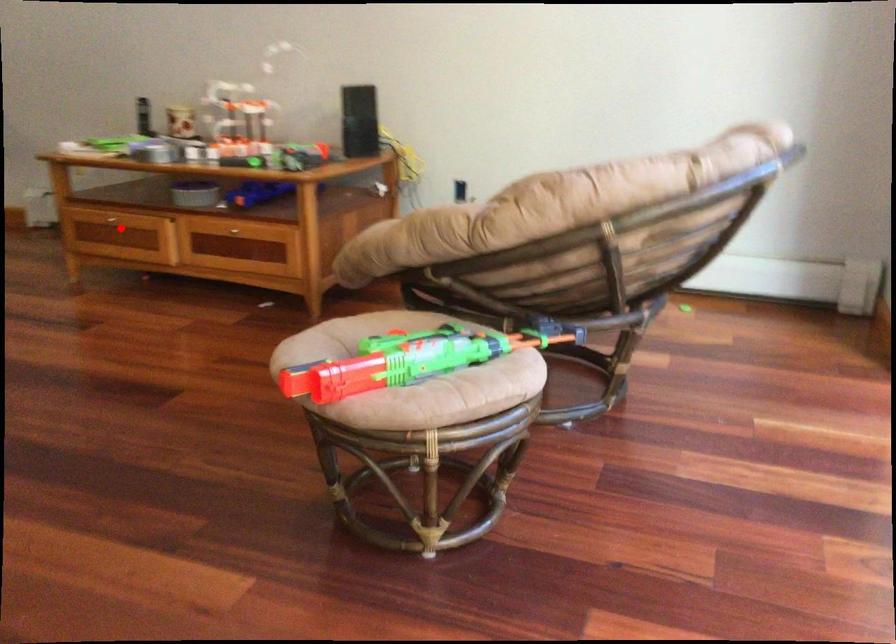
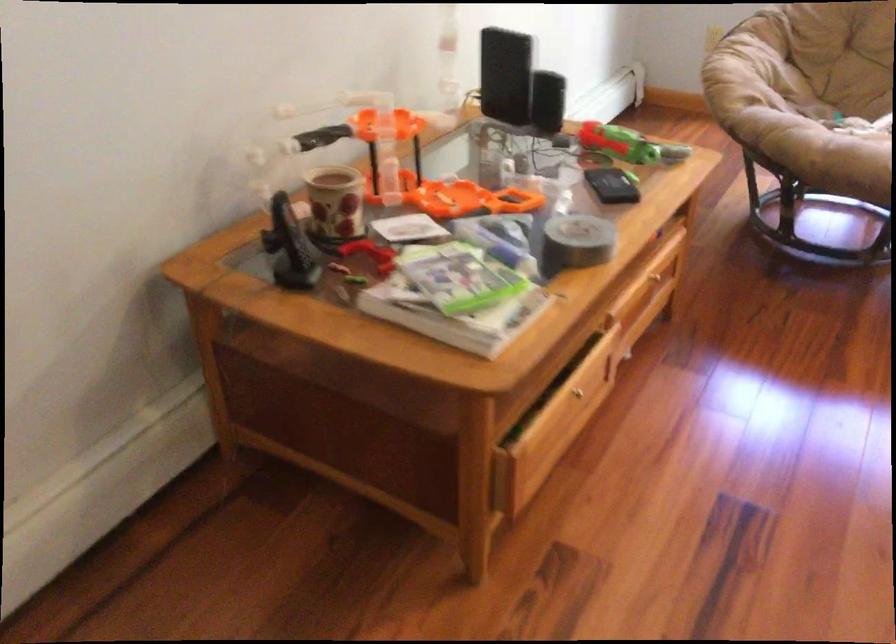
In the second image, find the point that corresponds to the highlighted location in the first image.

(578, 393)